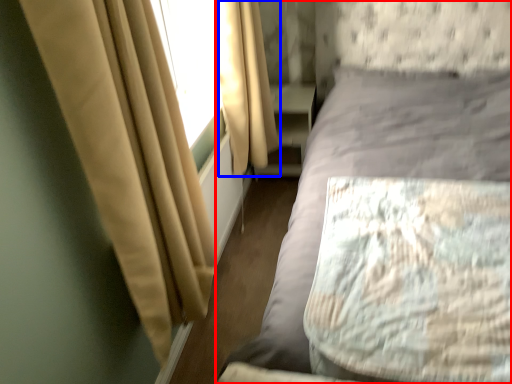
Question: Which object is further to the camera taking this photo, bed (highlighted by a red box) or curtain (highlighted by a blue box)?

Choices:
 (A) bed
 (B) curtain

Answer: (B)